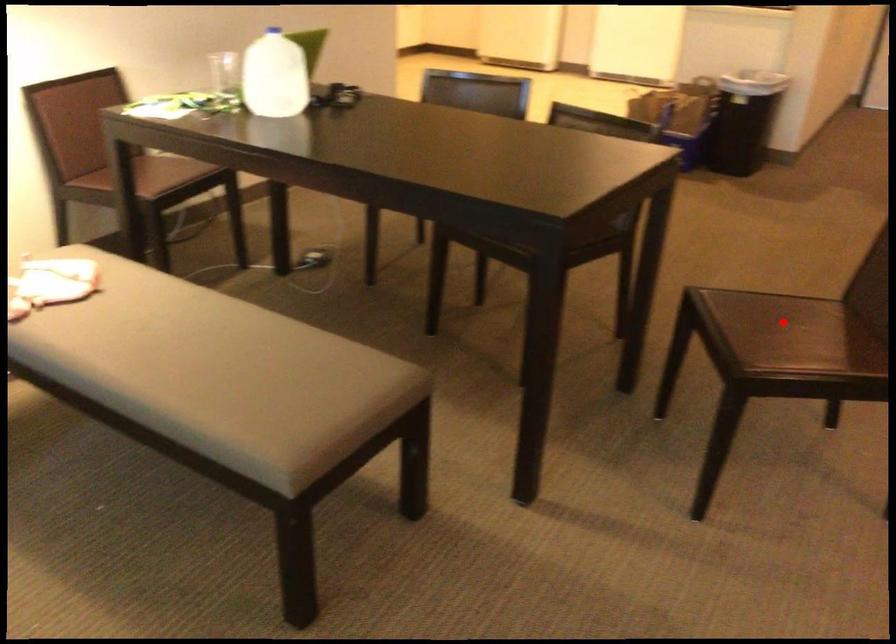
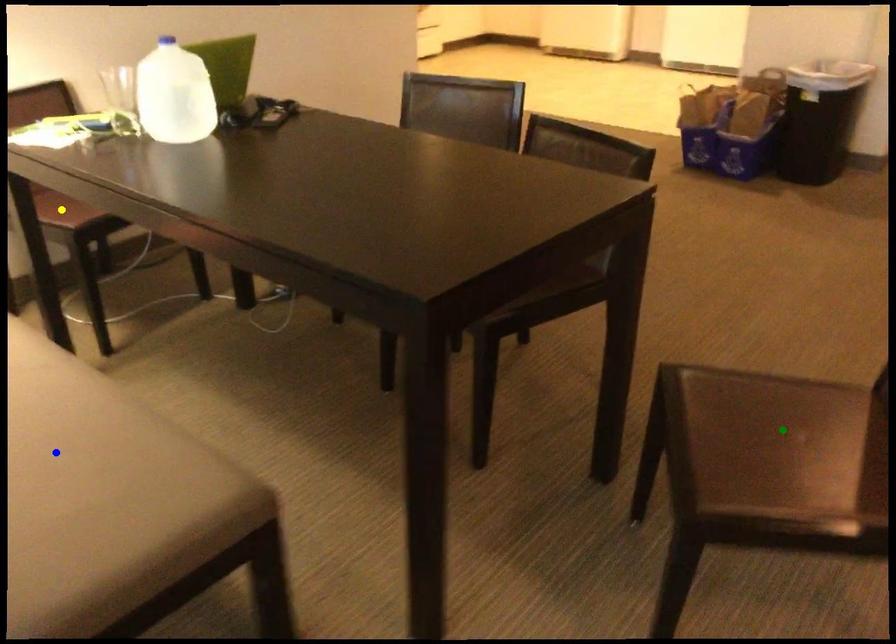
Question: I am providing you with two images of the same scene from different viewpoints. A red point is marked on the first image. You are given multiple points on the second image. In image 2, which mark is for the same physical point as the one in image 1?

Choices:
 (A) green point
 (B) yellow point
 (C) blue point

Answer: (A)